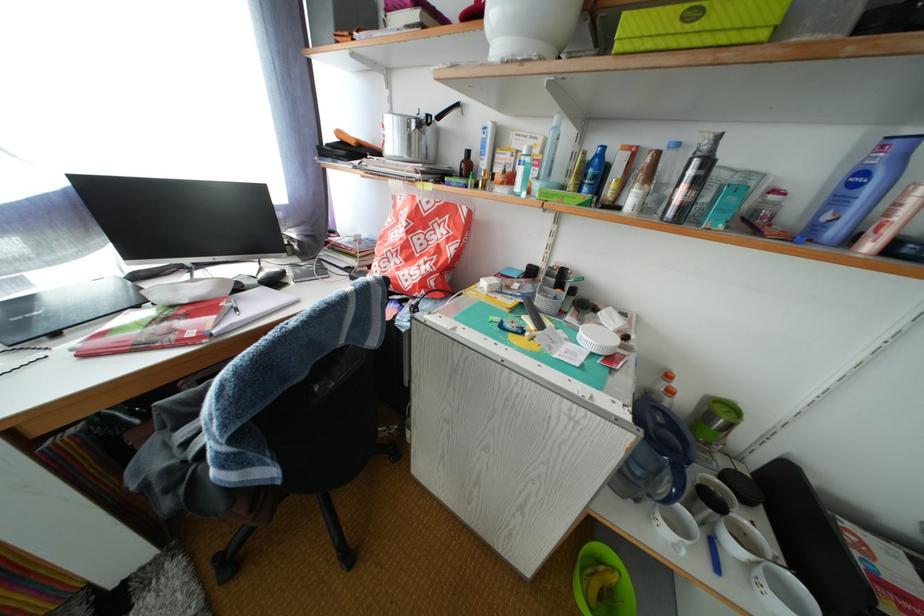
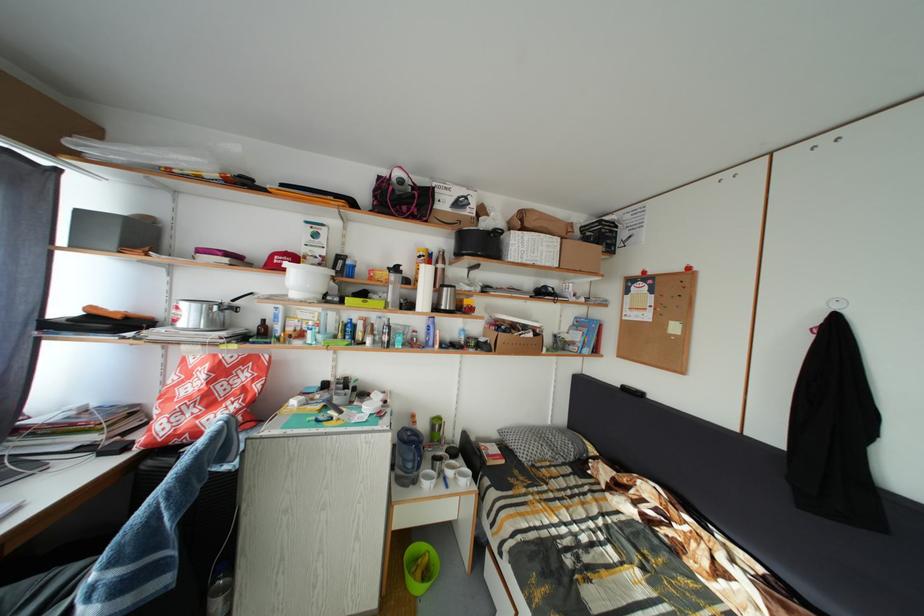
Find the pixel in the second image that matches (x=623, y=586) in the first image.

(435, 565)